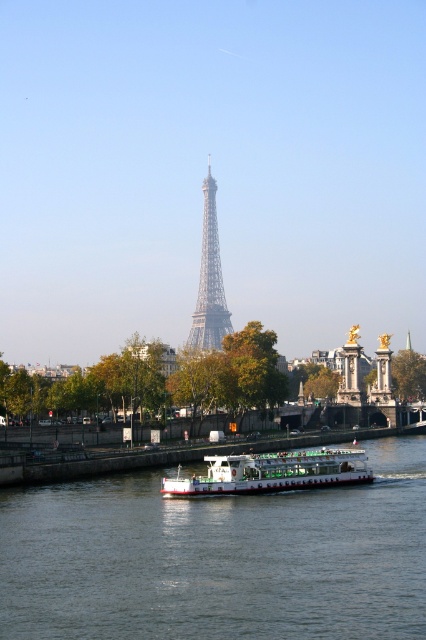
Who is higher up, white matte boat at center or shiny metallic eiffel tower at center?

shiny metallic eiffel tower at center is above.

Who is more distant from viewer, (357,461) or (201,300)?

The point (201,300) is behind.

At what (x,y) coordinates should I click in order to perform the action: click on white matte boat at center. Please return your answer as a coordinate pair (x, y). Looking at the image, I should click on (271, 472).

Does green smooth water at center have a greater height compared to white matte boat at center?

No, green smooth water at center is not taller than white matte boat at center.

Who is positioned more to the left, green smooth water at center or white matte boat at center?

green smooth water at center is more to the left.

This screenshot has height=640, width=426. I want to click on green smooth water at center, so click(x=218, y=557).

Which is behind, point (230, 572) or point (203, 220)?

Positioned behind is point (203, 220).

Is point (262, 547) farther from viewer compared to point (212, 330)?

No, (262, 547) is in front of (212, 330).

Does point (210, 609) come behind point (187, 340)?

No, (210, 609) is in front of (187, 340).

Image resolution: width=426 pixels, height=640 pixels. Identify the location of green smooth water at center. [218, 557].